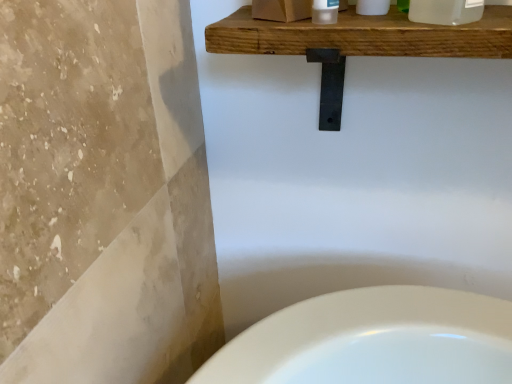
Question: Should I look upward or downward to see transparent plastic bottle at upper right?

Choices:
 (A) down
 (B) up

Answer: (B)

Question: From a real-world perspective, is transparent plastic bottle at upper right beneath wooden shelf at upper center?

Choices:
 (A) yes
 (B) no

Answer: (B)

Question: Is transparent plastic bottle at upper right in contact with wooden shelf at upper center?

Choices:
 (A) no
 (B) yes

Answer: (A)

Question: Is transparent plastic bottle at upper right aimed at wooden shelf at upper center?

Choices:
 (A) no
 (B) yes

Answer: (A)

Question: Is wooden shelf at upper center at the back of transparent plastic bottle at upper right?

Choices:
 (A) yes
 (B) no

Answer: (B)

Question: Does transparent plastic bottle at upper right have a greater width compared to wooden shelf at upper center?

Choices:
 (A) no
 (B) yes

Answer: (A)

Question: Can you confirm if transparent plastic bottle at upper right is thinner than wooden shelf at upper center?

Choices:
 (A) yes
 (B) no

Answer: (A)

Question: Can you confirm if wooden shelf at upper center is bigger than transparent plastic bottle at upper right?

Choices:
 (A) yes
 (B) no

Answer: (A)

Question: Is wooden shelf at upper center taller than transparent plastic bottle at upper right?

Choices:
 (A) yes
 (B) no

Answer: (A)

Question: From a real-world perspective, does wooden shelf at upper center stand above transparent plastic bottle at upper right?

Choices:
 (A) yes
 (B) no

Answer: (B)

Question: Can we say wooden shelf at upper center lies outside transparent plastic bottle at upper right?

Choices:
 (A) no
 (B) yes

Answer: (B)

Question: Is wooden shelf at upper center positioned with its back to transparent plastic bottle at upper right?

Choices:
 (A) yes
 (B) no

Answer: (B)

Question: Would you say wooden shelf at upper center contains transparent plastic bottle at upper right?

Choices:
 (A) yes
 (B) no

Answer: (B)

Question: From the image's perspective, is transparent plastic bottle at upper right above or below wooden shelf at upper center?

Choices:
 (A) above
 (B) below

Answer: (A)